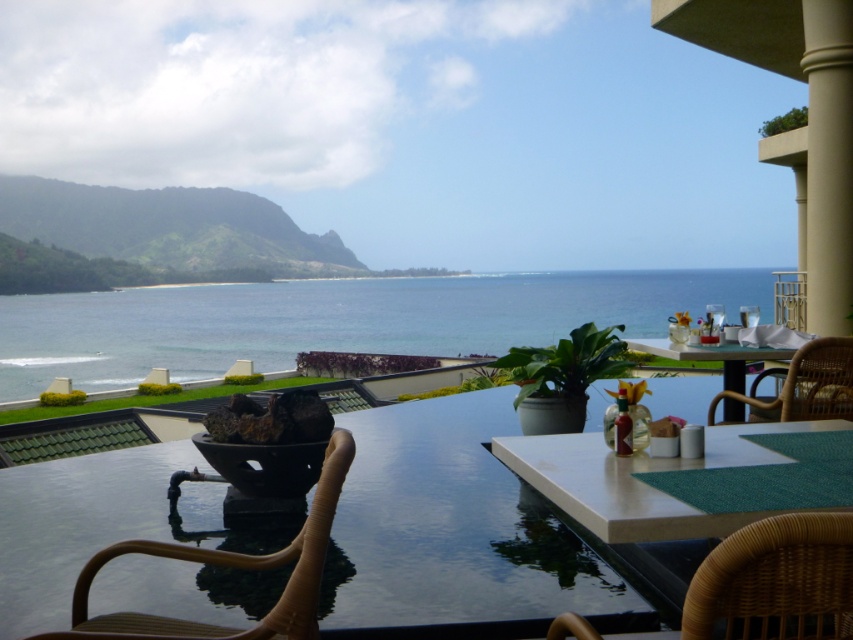
Question: Which of the following is the closest to the observer?

Choices:
 (A) (734, 360)
 (B) (56, 525)

Answer: (B)

Question: Can you confirm if beige concrete pillar at right is positioned above translucent glass table at center?

Choices:
 (A) yes
 (B) no

Answer: (A)

Question: Which point is farther from the camera taking this photo?

Choices:
 (A) (805, 541)
 (B) (77, 461)

Answer: (B)

Question: Observing the image, what is the correct spatial positioning of blue water at center in reference to brown wicker chair at lower left?

Choices:
 (A) left
 (B) right

Answer: (A)

Question: Observing the image, what is the correct spatial positioning of blue water at center in reference to translucent glass table at center?

Choices:
 (A) below
 (B) above

Answer: (A)

Question: Among these points, which one is nearest to the camera?

Choices:
 (A) (291, 548)
 (B) (221, 616)

Answer: (A)